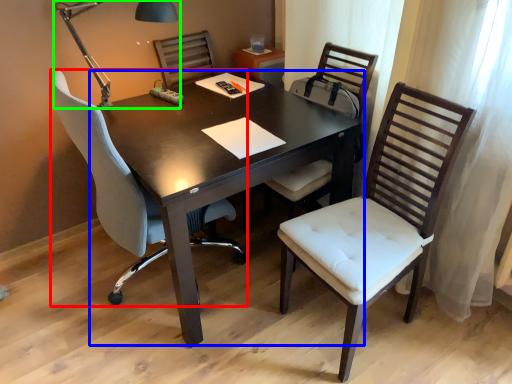
Question: Which is farther away from chair (highlighted by a red box)? table (highlighted by a blue box) or table lamp (highlighted by a green box)?

Choices:
 (A) table
 (B) table lamp

Answer: (B)